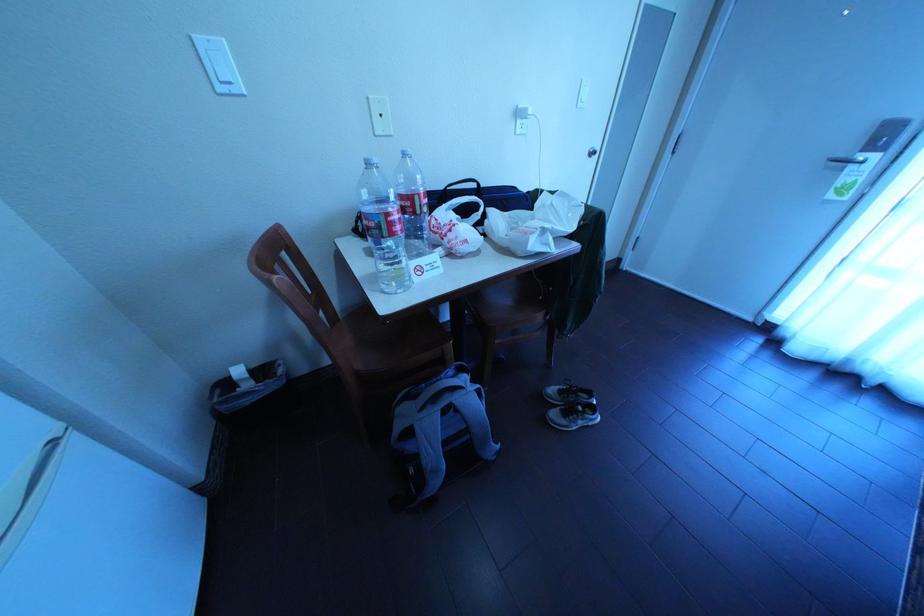
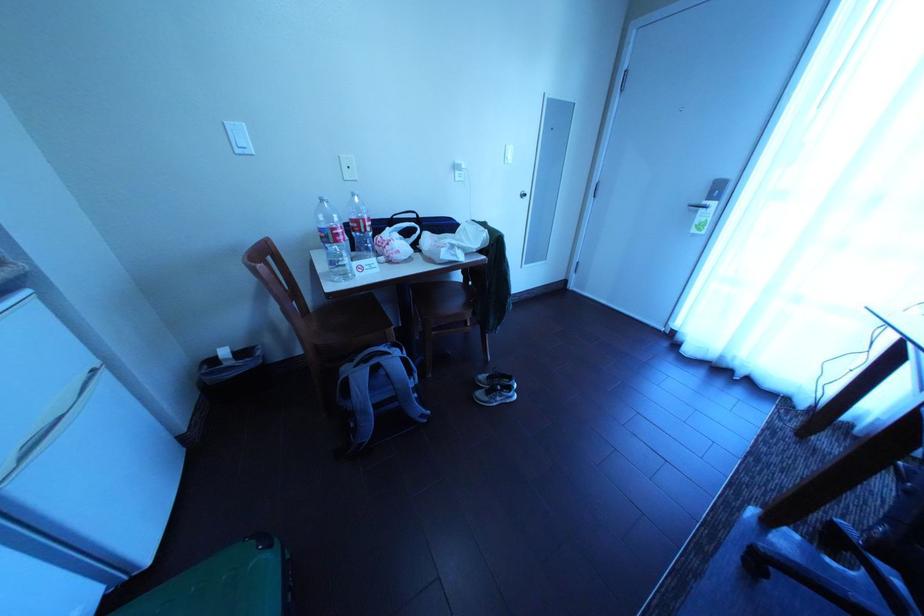
In a continuous first-person perspective shot, in which direction is the camera moving?

The cameraman moved toward right, backward.